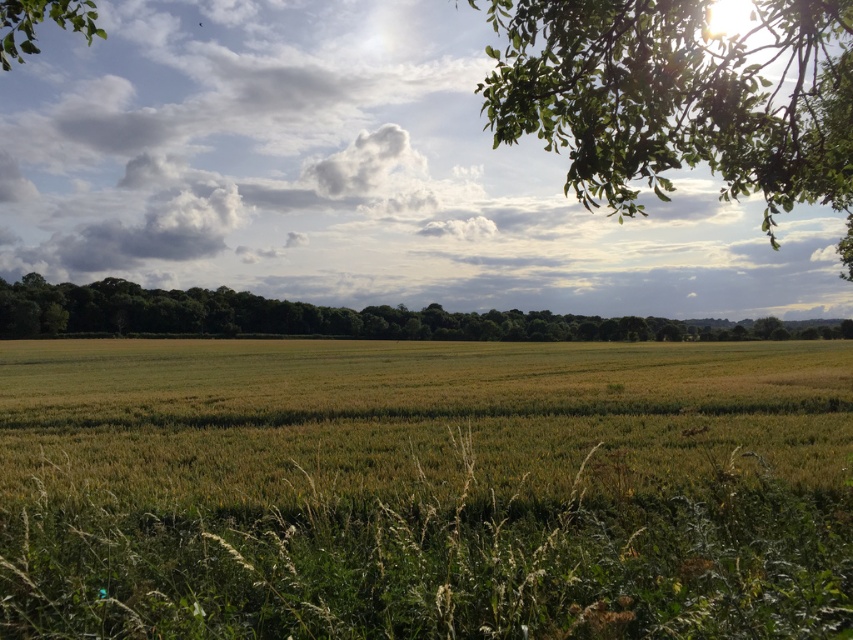
You are standing in the middle of the wheat field and see the green leafy tree at upper right and the green leafy tree at upper left. Which tree would you walk towards if you want to reach the one that is closer to the forested area in the background?

The green leafy tree at upper right is positioned under the green leafy tree at upper left, meaning it is closer to the forested area in the background. Therefore, walking towards the green leafy tree at upper right would lead you to the closer tree.

You are a landscape architect planning to plant a new row of trees between the green leafy tree at upper right and the green leafy trees at center. The recommended spacing between new trees is 10 meters. How many trees can you plant along the straight path connecting them?

The distance between the green leafy tree at upper right and the green leafy trees at center is 78.83 meters. With a spacing of 10 meters between each new tree, you can plant approximately 7 trees along the path. This calculation is based on dividing the total distance by the spacing requirement and rounding down to ensure proper spacing between each tree.